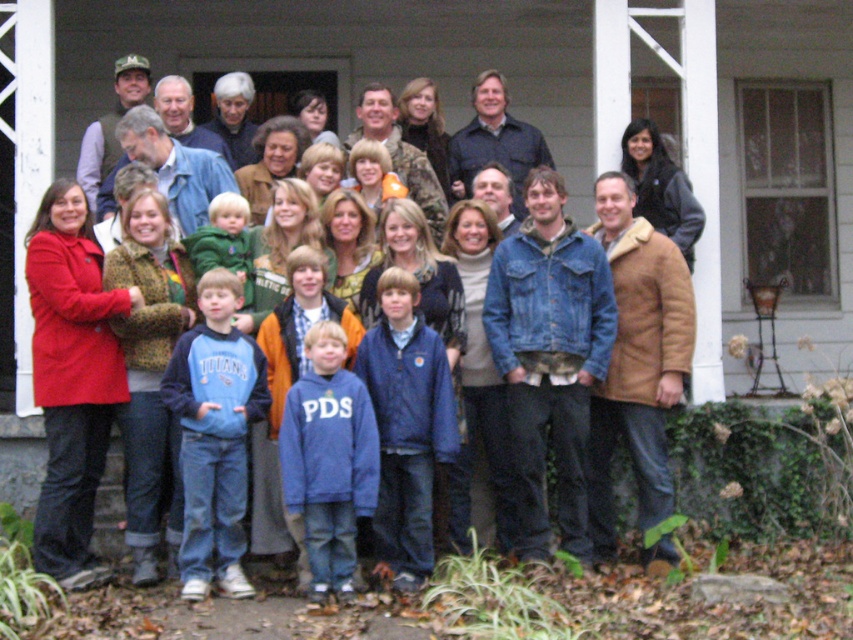
Which is more to the left, dark blue denim jacket at center or denim jacket at center?

denim jacket at center is more to the left.

How distant is dark blue denim jacket at center from denim jacket at center?

A distance of 4.97 feet exists between dark blue denim jacket at center and denim jacket at center.

Where is `dark blue denim jacket at center`? The height and width of the screenshot is (640, 853). dark blue denim jacket at center is located at coordinates (494, 141).

Does tan suede coat at lower right have a smaller size compared to blue fleece sweatshirt at center?

Actually, tan suede coat at lower right might be larger than blue fleece sweatshirt at center.

Does tan suede coat at lower right have a greater height compared to blue fleece sweatshirt at center?

Yes.

Locate an element on the screen. This screenshot has height=640, width=853. tan suede coat at lower right is located at coordinates (637, 358).

Who is positioned more to the right, navy blue fleece at center or blue fleece sweatshirt at center?

navy blue fleece at center is more to the right.

Where is `navy blue fleece at center`? The image size is (853, 640). navy blue fleece at center is located at coordinates pos(405,426).

This screenshot has width=853, height=640. In order to click on navy blue fleece at center in this screenshot , I will do `click(405, 426)`.